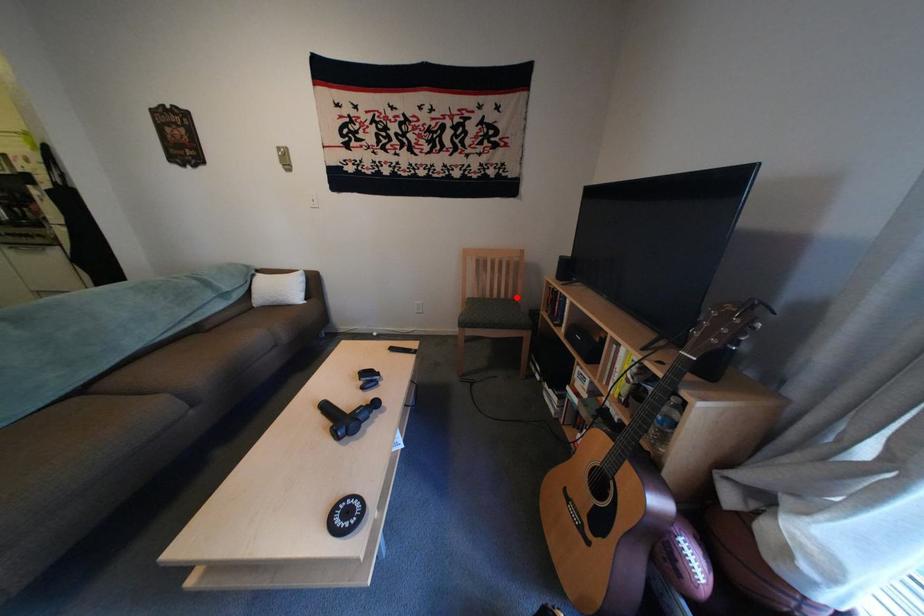
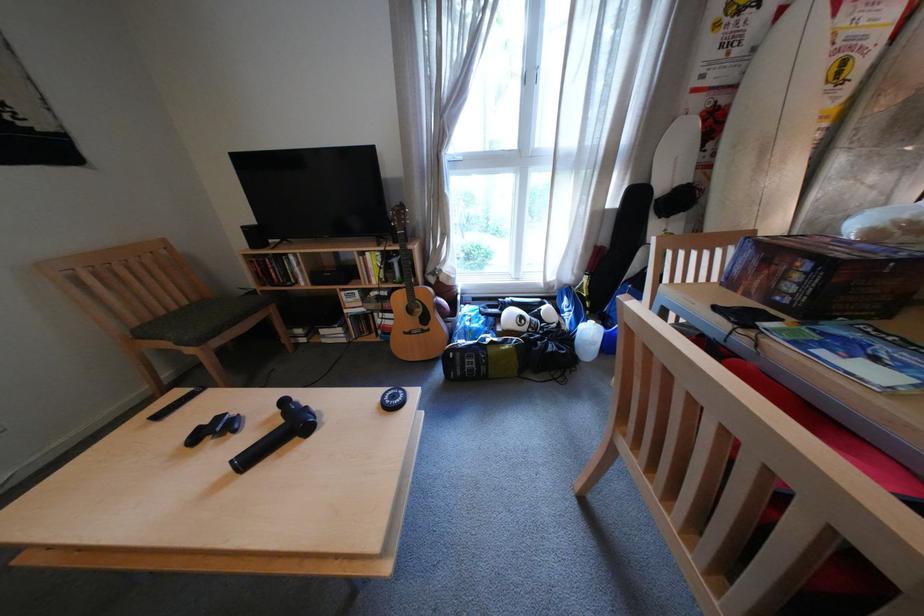
In the second image, find the point that corresponds to the highlighted location in the first image.

(199, 304)